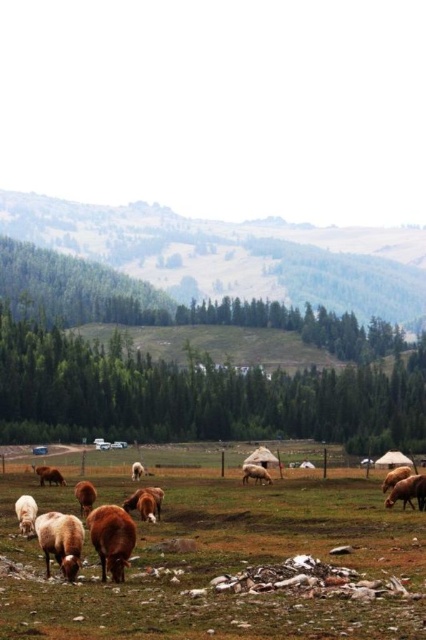
Question: Which of the following is the farthest from the observer?

Choices:
 (A) (242, 474)
 (B) (71, 556)
 (C) (305, 621)

Answer: (A)

Question: Can you confirm if brown grassy field at lower center is positioned to the right of brown furry cow at center?

Choices:
 (A) yes
 (B) no

Answer: (A)

Question: Can you confirm if white woolly sheep at lower left is wider than brown woolly sheep at center?

Choices:
 (A) no
 (B) yes

Answer: (B)

Question: Which of the following is the farthest from the observer?

Choices:
 (A) brown furry cow at center
 (B) brown furry cow at lower left

Answer: (B)

Question: Which of the following is the farthest from the observer?

Choices:
 (A) (350, 480)
 (B) (249, 474)

Answer: (A)

Question: Where is brown woolly sheep at center located in relation to brown furry cow at lower left in the image?

Choices:
 (A) below
 (B) above

Answer: (A)